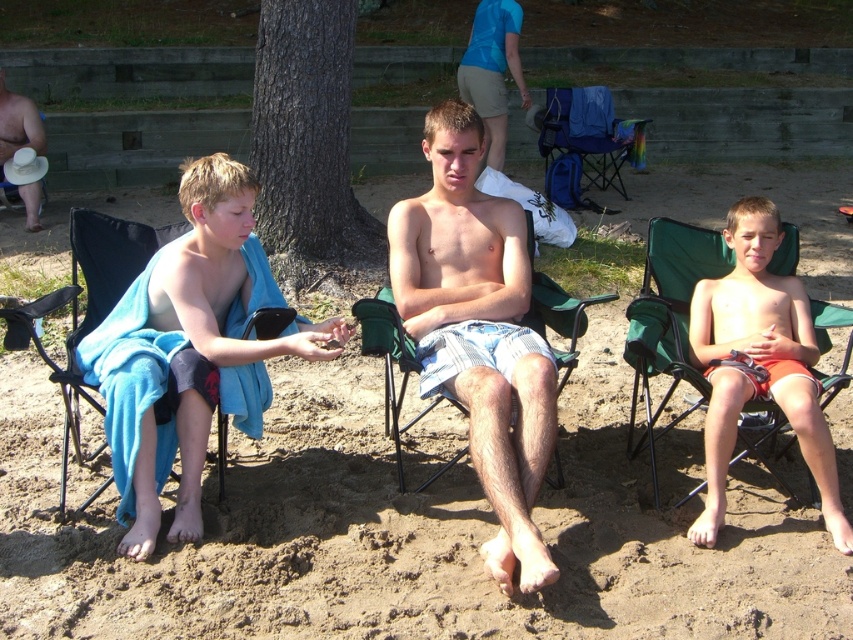
Question: Is blue fabric beach chair at left wider than white fabric hat at upper left?

Choices:
 (A) yes
 (B) no

Answer: (B)

Question: Which object is the farthest from the brown sandy beach at center?

Choices:
 (A) green fabric beach chair at center
 (B) orange cotton shorts at center
 (C) blue fabric shorts at center

Answer: (C)

Question: Which object is the closest to the orange cotton shorts at center?

Choices:
 (A) brown sandy beach at center
 (B) brown rough bark tree at center

Answer: (A)

Question: Is blue fabric beach chair at left smaller than blue fabric shorts at center?

Choices:
 (A) yes
 (B) no

Answer: (A)

Question: Which object is the closest to the brown sandy beach at center?

Choices:
 (A) white fabric hat at upper left
 (B) orange cotton shorts at center

Answer: (B)

Question: Can you confirm if orange cotton shorts at center is smaller than green fabric beach chair at center?

Choices:
 (A) yes
 (B) no

Answer: (B)